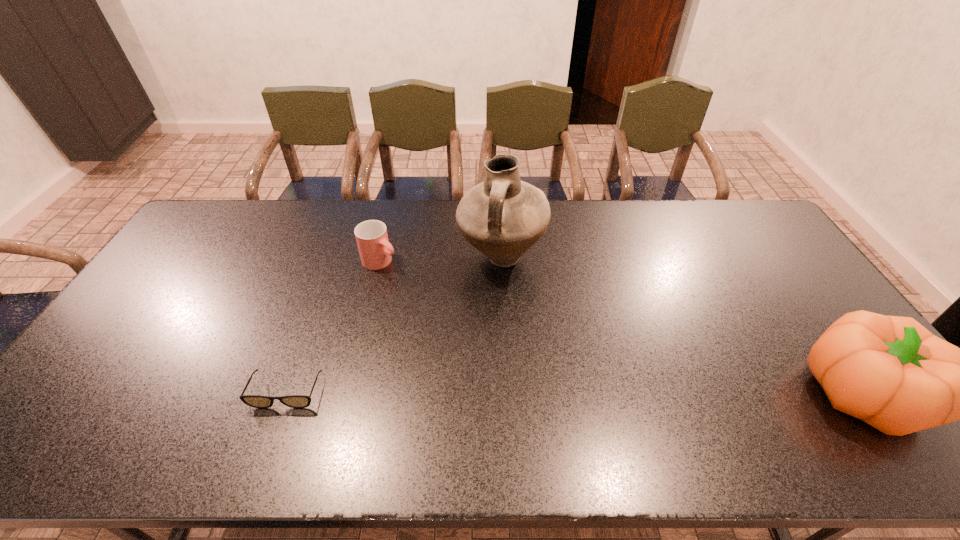
Where is `sunglasses`? sunglasses is located at coordinates (256, 401).

Find the location of a particular element. the leftmost object is located at coordinates (256, 401).

Image resolution: width=960 pixels, height=540 pixels. I want to click on the second shortest object, so click(375, 251).

Locate an element on the screen. The image size is (960, 540). cup is located at coordinates (375, 251).

The height and width of the screenshot is (540, 960). What are the coordinates of `the third object from left to right` in the screenshot? It's located at (502, 217).

Identify the location of the tallest object. (502, 217).

At what (x,y) coordinates should I click in order to perform the action: click on free region located 0.210m on the side of the third tallest object with the handle. Please return your answer as a coordinate pair (x, y). Looking at the image, I should click on (442, 298).

Locate an element on the screen. The image size is (960, 540). vacant point located on the side of the third tallest object with the handle is located at coordinates (439, 297).

The height and width of the screenshot is (540, 960). Find the location of `free space located on the side of the third tallest object with the handle`. free space located on the side of the third tallest object with the handle is located at coordinates click(x=437, y=295).

Find the location of a particular element. This screenshot has width=960, height=540. vacant space located on the handle side of the second object from right to left is located at coordinates (517, 355).